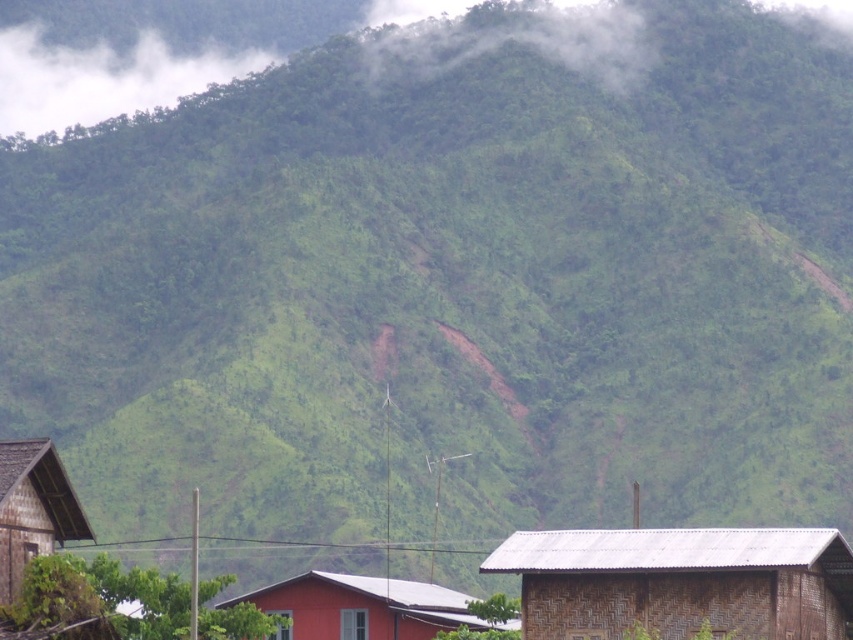
Is white foggy cloud at upper center above matte red hut at center?

Yes.

Is white foggy cloud at upper center smaller than matte red hut at center?

No.

Does point (614, 13) come farther from viewer compared to point (409, 596)?

Yes, it is.

Find the location of `white foggy cloud at upper center`. white foggy cloud at upper center is located at coordinates (515, 35).

Is white foggy cloud at upper center in front of wooden hut at lower left?

No, white foggy cloud at upper center is further to the viewer.

Can you confirm if white foggy cloud at upper center is positioned above wooden hut at lower left?

Yes.

Is point (625, 29) farther from camera compared to point (57, 515)?

That is True.

You are a GUI agent. You are given a task and a screenshot of the screen. Output one action in this format:
    pyautogui.click(x=<x>, y=<y>)
    Task: Click on the white foggy cloud at upper center
    The image size is (853, 640).
    Given the screenshot: What is the action you would take?
    pyautogui.click(x=515, y=35)

Does point (776, 557) come farther from viewer compared to point (553, 12)?

No, it is in front of (553, 12).

Can you confirm if brown woven hut at lower right is positioned to the right of white foggy cloud at upper center?

Yes, brown woven hut at lower right is to the right of white foggy cloud at upper center.

Which is in front, point (483, 563) or point (401, 45)?

Point (483, 563) is in front.

The image size is (853, 640). In order to click on brown woven hut at lower right in this screenshot , I will do `click(680, 580)`.